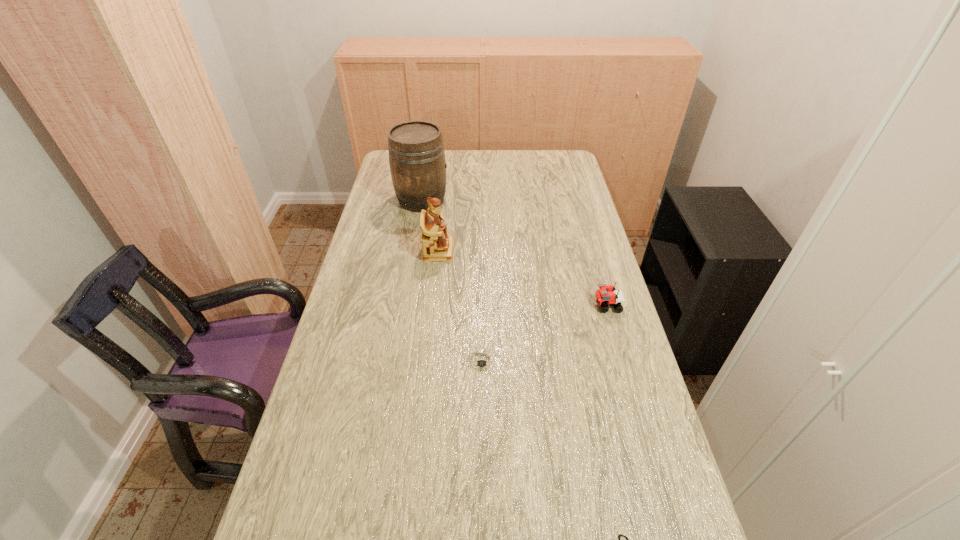
The image size is (960, 540). Identify the location of free space between the third farthest object and the fourth farthest object. pyautogui.click(x=544, y=333).

Where is `vacant point located between the cider and the Lego`? This screenshot has height=540, width=960. vacant point located between the cider and the Lego is located at coordinates (515, 253).

At what (x,y) coordinates should I click in order to perform the action: click on vacant space that's between the watch and the tallest object. Please return your answer as a coordinate pair (x, y). The height and width of the screenshot is (540, 960). Looking at the image, I should click on (452, 280).

The height and width of the screenshot is (540, 960). What are the coordinates of `unoccupied position between the fourth tallest object and the fourth nearest object` in the screenshot? It's located at (460, 306).

At what (x,y) coordinates should I click in order to perform the action: click on empty location between the Lego and the cider. Please return your answer as a coordinate pair (x, y). Looking at the image, I should click on (515, 253).

Where is `unoccupied area between the fourth nearest object and the fourth farthest object`? unoccupied area between the fourth nearest object and the fourth farthest object is located at coordinates (460, 306).

Locate an element on the screen. The image size is (960, 540). object that is the fourth closest one to the tallest object is located at coordinates (620, 535).

The height and width of the screenshot is (540, 960). I want to click on object that is the fourth closest to the third tallest object, so click(x=416, y=153).

Find the location of a particular element. vacant region that satisfies the following two spatial constraints: 1. on the front-facing side of the rightmost object; 2. on the face of the fourth tallest object is located at coordinates (623, 361).